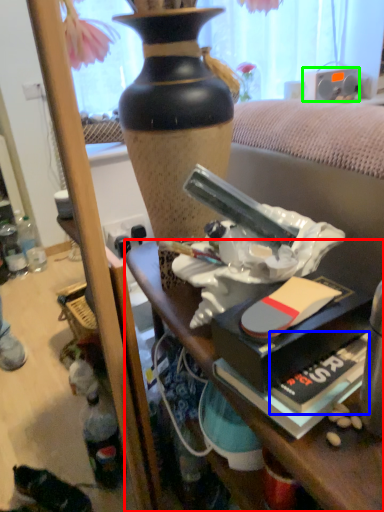
Question: Which object is the closest to the desk (highlighted by a red box)? Choose among these: paperback book (highlighted by a blue box) or loudspeaker (highlighted by a green box).

Choices:
 (A) paperback book
 (B) loudspeaker

Answer: (A)